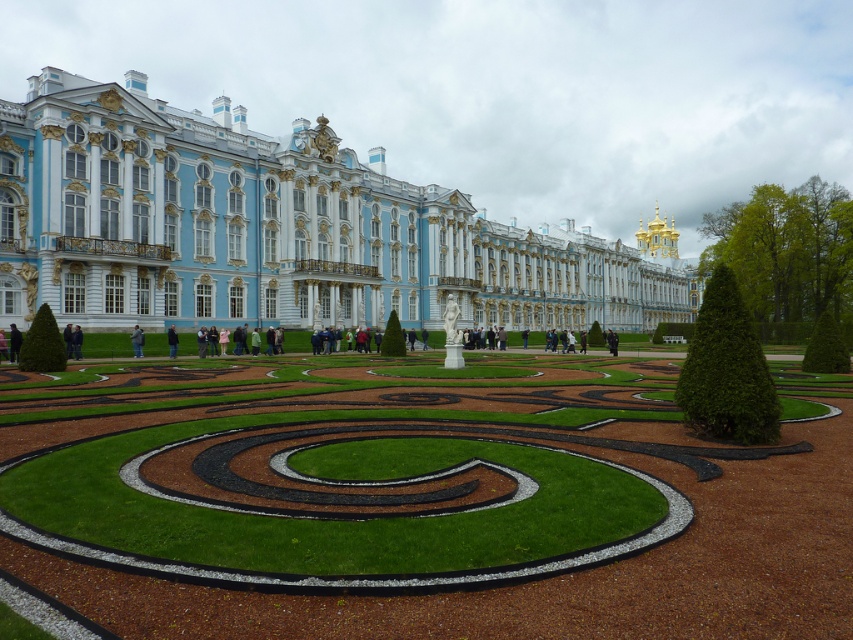
Question: Does green grass at center appear over dark blue jacket at center?

Choices:
 (A) no
 (B) yes

Answer: (A)

Question: Estimate the real-world distances between objects in this image. Which object is closer to the green grass at center?

Choices:
 (A) dark blue jeans at center
 (B) dark blue jacket at center

Answer: (A)

Question: Does green grass at center have a smaller size compared to white glossy palace at center?

Choices:
 (A) no
 (B) yes

Answer: (B)

Question: Is white glossy palace at center positioned at the back of dark blue jacket at center?

Choices:
 (A) yes
 (B) no

Answer: (B)

Question: Estimate the real-world distances between objects in this image. Which object is closer to the dark blue fabric jacket at lower left?

Choices:
 (A) green grass at center
 (B) white glossy palace at center

Answer: (A)

Question: Which object is the farthest from the dark blue jacket at center?

Choices:
 (A) dark blue jeans at center
 (B) green grass at center

Answer: (B)